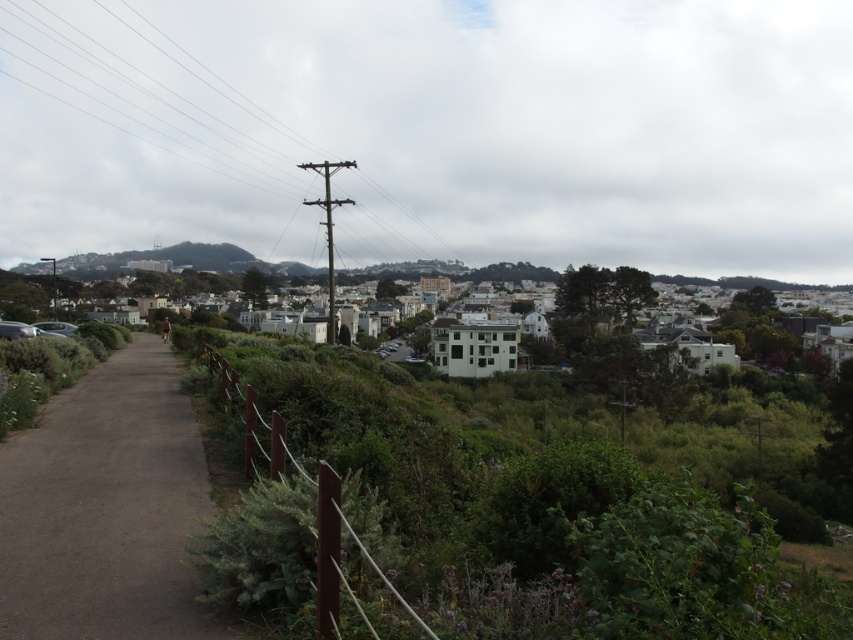
You are a hiker planning to take a photo of the wooden pole at upper center and the dirt path at center from a position near the wooden fence. Which object will appear larger in your photo?

The wooden pole at upper center is much taller than the dirt path at center, so it will appear larger in the photo.

You are a hiker standing at the bottom left corner of the trail. You see the wooden pole at upper center and the white matte building at center. Which object is taller?

The wooden pole at upper center is taller than the white matte building at center.

You are standing at the starting point of the paved pathway and want to reach a destination located at point (173,289). There is an obstacle at point (74,428). Which point should you avoid to stay on the path?

You should avoid point (74,428) because it is closer to the camera than point (173,289), meaning it is in front of the destination and might block the path.